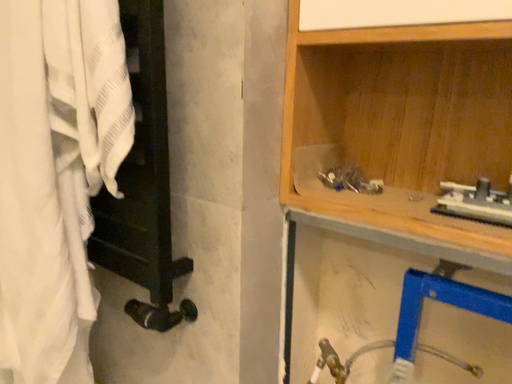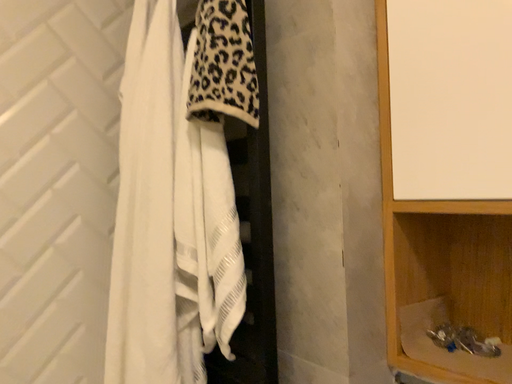
Question: Which way did the camera rotate in the video?

Choices:
 (A) rotated right
 (B) rotated left

Answer: (B)